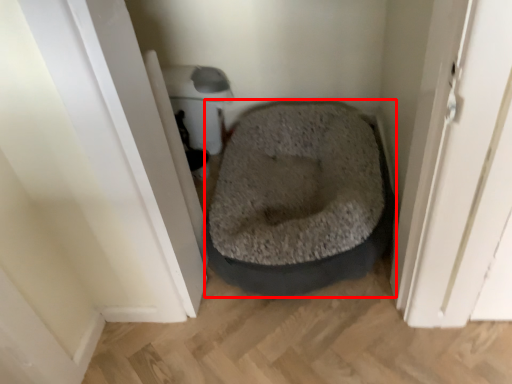
Question: Observing the image, what is the correct spatial positioning of dog bed (annotated by the red box) in reference to screen door?

Choices:
 (A) left
 (B) right

Answer: (B)